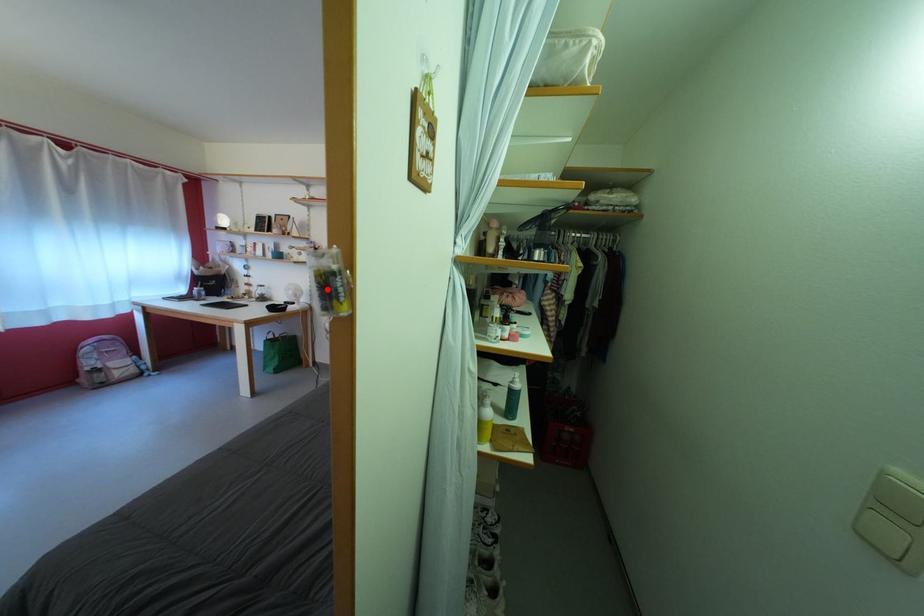
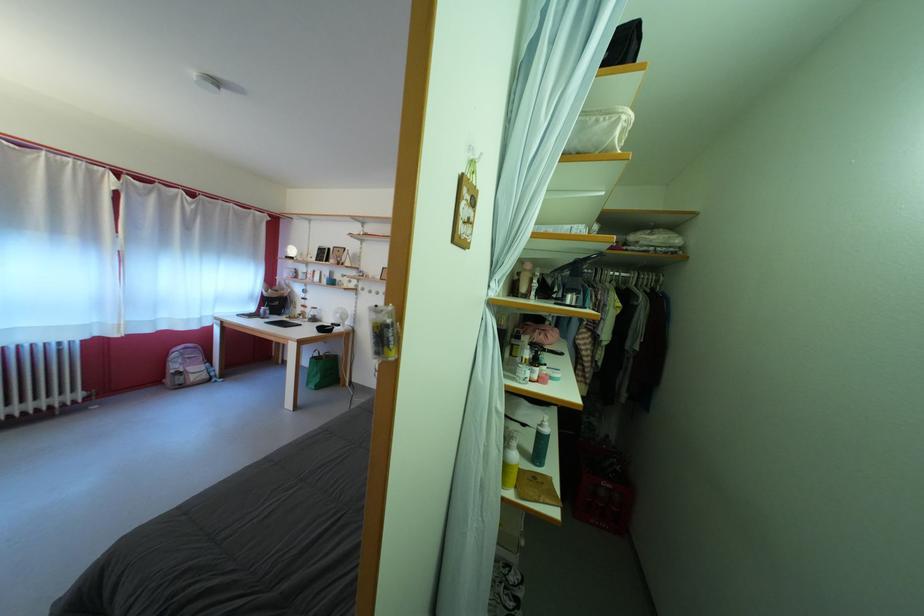
Find the pixel in the second image that matches the highlighted location in the first image.

(383, 339)